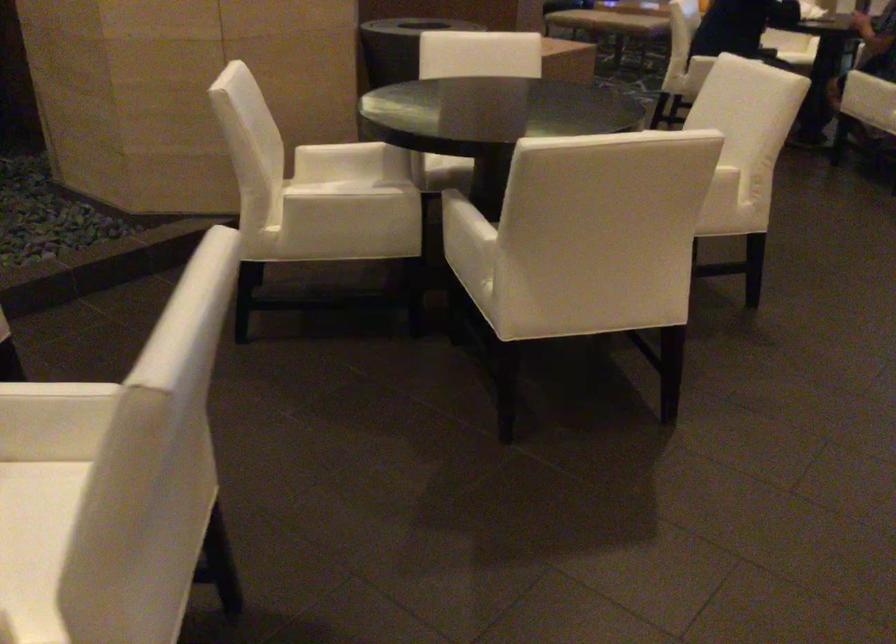
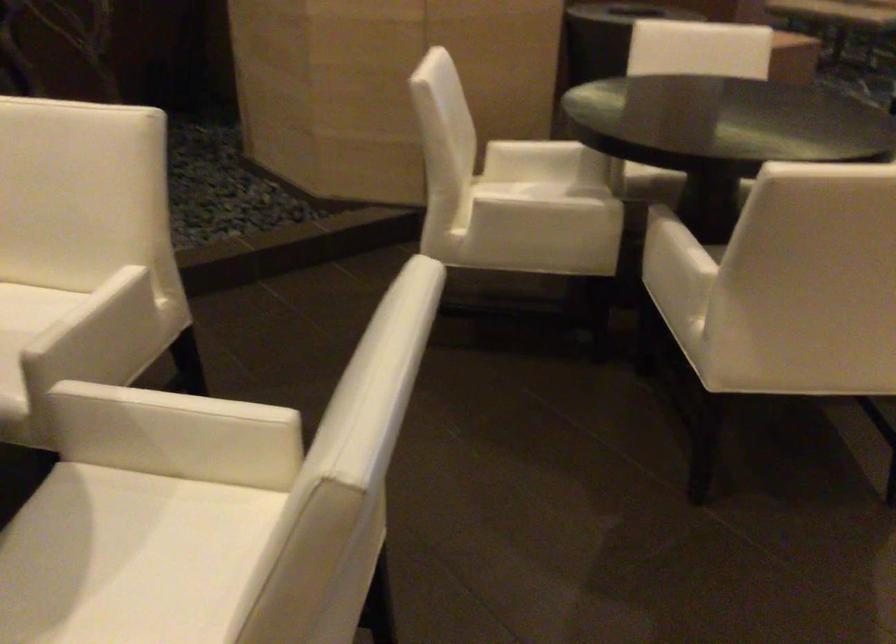
The point at (540, 237) is marked in the first image. Where is the corresponding point in the second image?

(778, 277)